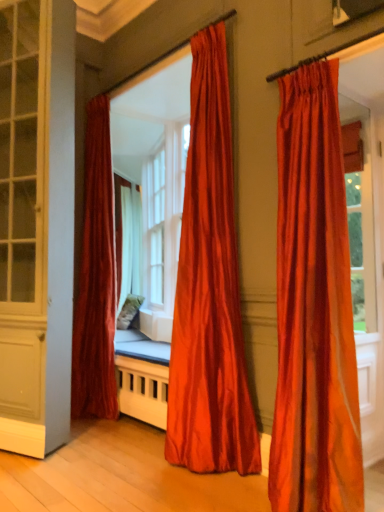
Question: From the image's perspective, does matte white screen door at left appear higher than satin orange curtain at center, which is the 2th curtain in back-to-front order?

Choices:
 (A) no
 (B) yes

Answer: (B)

Question: From the image's perspective, is matte white screen door at left under satin orange curtain at center, placed as the 2th curtain when sorted from left to right?

Choices:
 (A) no
 (B) yes

Answer: (A)

Question: Is matte white screen door at left thinner than satin orange curtain at center, arranged as the second curtain when viewed from the front?

Choices:
 (A) no
 (B) yes

Answer: (B)

Question: Can you confirm if matte white screen door at left is bigger than satin orange curtain at center, placed as the 2th curtain when sorted from left to right?

Choices:
 (A) yes
 (B) no

Answer: (A)

Question: From a real-world perspective, is matte white screen door at left located beneath satin orange curtain at center, which is the 2th curtain in back-to-front order?

Choices:
 (A) yes
 (B) no

Answer: (B)

Question: Does point (201, 148) appear closer or farther from the camera than point (99, 394)?

Choices:
 (A) farther
 (B) closer

Answer: (B)

Question: Is satin orange curtain at center, which is the 2th curtain in back-to-front order, in front of or behind satin red curtain at left, the 3th curtain positioned from the right, in the image?

Choices:
 (A) front
 (B) behind

Answer: (A)

Question: Considering the positions of satin orange curtain at center, placed as the 2th curtain when sorted from left to right, and satin red curtain at left, the 3th curtain positioned from the right, in the image, is satin orange curtain at center, placed as the 2th curtain when sorted from left to right, taller or shorter than satin red curtain at left, the 3th curtain positioned from the right,?

Choices:
 (A) tall
 (B) short

Answer: (B)

Question: In terms of width, does satin orange curtain at center, which is the 2th curtain in back-to-front order, look wider or thinner when compared to satin red curtain at left, which is counted as the 1th curtain, starting from the back?

Choices:
 (A) thin
 (B) wide

Answer: (B)

Question: From their relative heights in the image, would you say satin orange curtain at center, placed as the 2th curtain when sorted from left to right, is taller or shorter than matte white screen door at left?

Choices:
 (A) short
 (B) tall

Answer: (A)

Question: From the image's perspective, is satin orange curtain at center, which is the 2th curtain in back-to-front order, above or below matte white screen door at left?

Choices:
 (A) below
 (B) above

Answer: (A)

Question: Considering the positions of point (200, 240) and point (23, 179), is point (200, 240) closer or farther from the camera than point (23, 179)?

Choices:
 (A) farther
 (B) closer

Answer: (B)

Question: From a real-world perspective, is satin orange curtain at center, which ranks as the 2th curtain in right-to-left order, physically located above or below matte white screen door at left?

Choices:
 (A) below
 (B) above

Answer: (A)

Question: From the image's perspective, is satin orange curtain at center, arranged as the second curtain when viewed from the front, above or below white glass bay window at center?

Choices:
 (A) above
 (B) below

Answer: (B)

Question: Considering their positions, is satin orange curtain at center, which is the 2th curtain in back-to-front order, located in front of or behind white glass bay window at center?

Choices:
 (A) behind
 (B) front

Answer: (B)